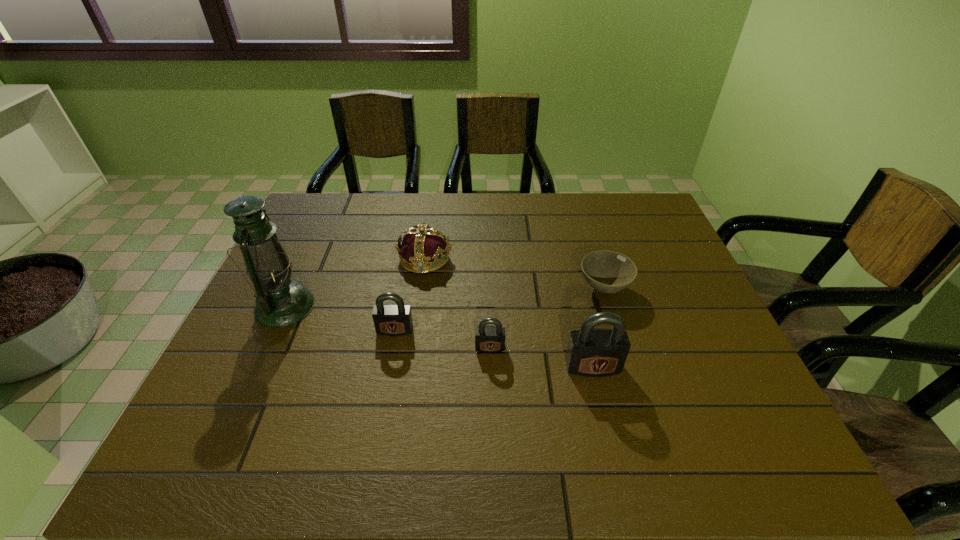
The height and width of the screenshot is (540, 960). What are the coordinates of `free point located on the front of the farthest padlock near the keyhole` in the screenshot? It's located at click(383, 393).

The width and height of the screenshot is (960, 540). What are the coordinates of `free region located 0.130m on the front of the fourth object from left to right near the keyhole` in the screenshot? It's located at (492, 402).

The width and height of the screenshot is (960, 540). In order to click on vacant region located 0.180m on the back of the crown in this screenshot , I will do `click(432, 210)`.

What are the coordinates of `free space located on the front of the shortest object` in the screenshot? It's located at (622, 349).

This screenshot has height=540, width=960. In order to click on vacant space situated 0.220m on the back of the leftmost object in this screenshot , I will do point(317,237).

The height and width of the screenshot is (540, 960). Identify the location of object that is at the left edge. (280, 301).

Where is `free spot at the far edge of the desktop`? The width and height of the screenshot is (960, 540). free spot at the far edge of the desktop is located at coordinates (484, 195).

The height and width of the screenshot is (540, 960). In the image, there is a desktop. In order to click on vacant space at the near edge in this screenshot , I will do `click(564, 413)`.

In the image, there is a desktop. Identify the location of vacant space at the left edge. point(253,352).

This screenshot has height=540, width=960. In order to click on vacant space at the right edge of the desktop in this screenshot , I will do `click(660, 322)`.